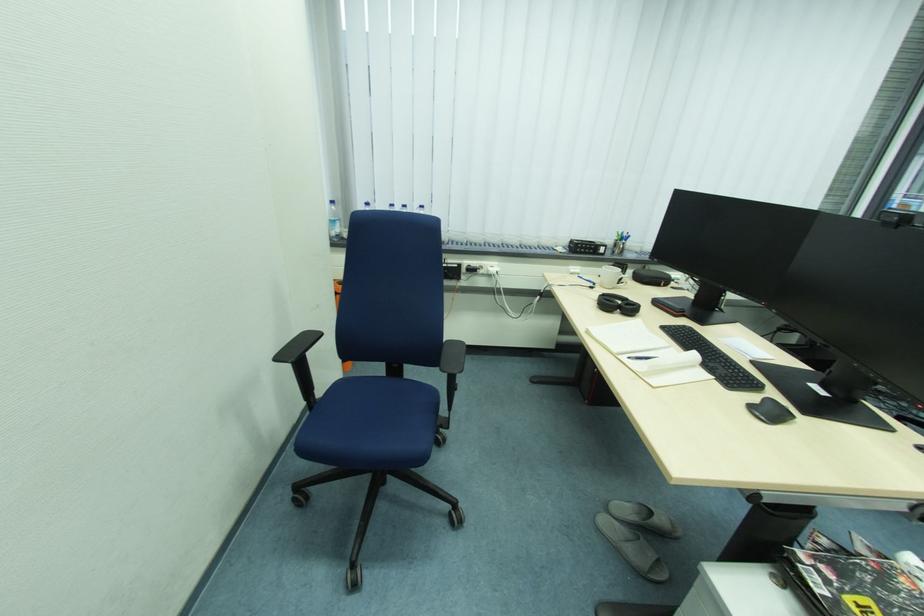
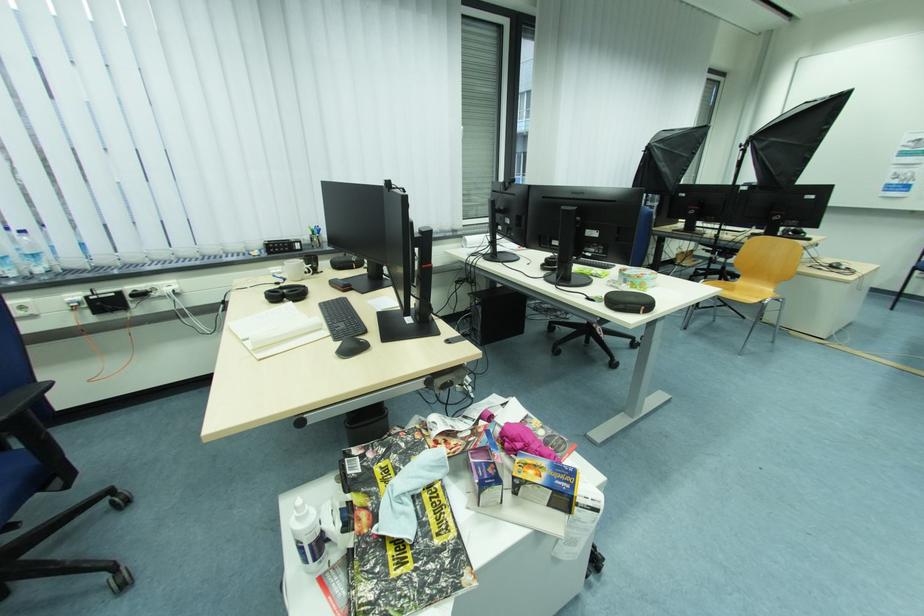
The point at (x=626, y=270) is marked in the first image. Where is the corresponding point in the second image?

(309, 262)